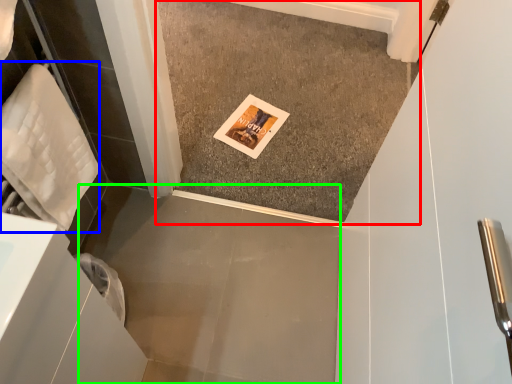
Question: Considering the real-world distances, which object is farthest from concrete (highlighted by a red box)? material (highlighted by a blue box) or concrete (highlighted by a green box)?

Choices:
 (A) material
 (B) concrete

Answer: (A)